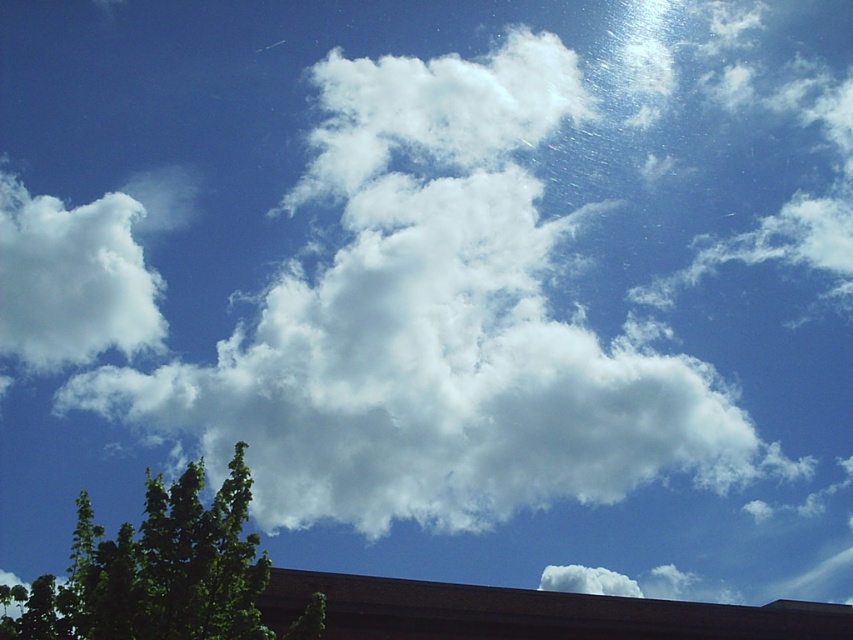
Question: Can you confirm if green leafy tree at lower left is thinner than white fluffy cloud at upper left?

Choices:
 (A) yes
 (B) no

Answer: (A)

Question: Which object is closer to the camera taking this photo?

Choices:
 (A) green leafy tree at lower left
 (B) white fluffy cloud at upper left

Answer: (A)

Question: Is green leafy tree at lower left smaller than white fluffy cloud at upper left?

Choices:
 (A) yes
 (B) no

Answer: (A)

Question: Among these objects, which one is farthest from the camera?

Choices:
 (A) green leafy tree at lower left
 (B) white fluffy cloud at upper left

Answer: (B)

Question: Which of the following is the closest to the observer?

Choices:
 (A) (247, 509)
 (B) (137, 243)

Answer: (A)

Question: Can you confirm if green leafy tree at lower left is positioned below white fluffy cloud at upper left?

Choices:
 (A) no
 (B) yes

Answer: (B)